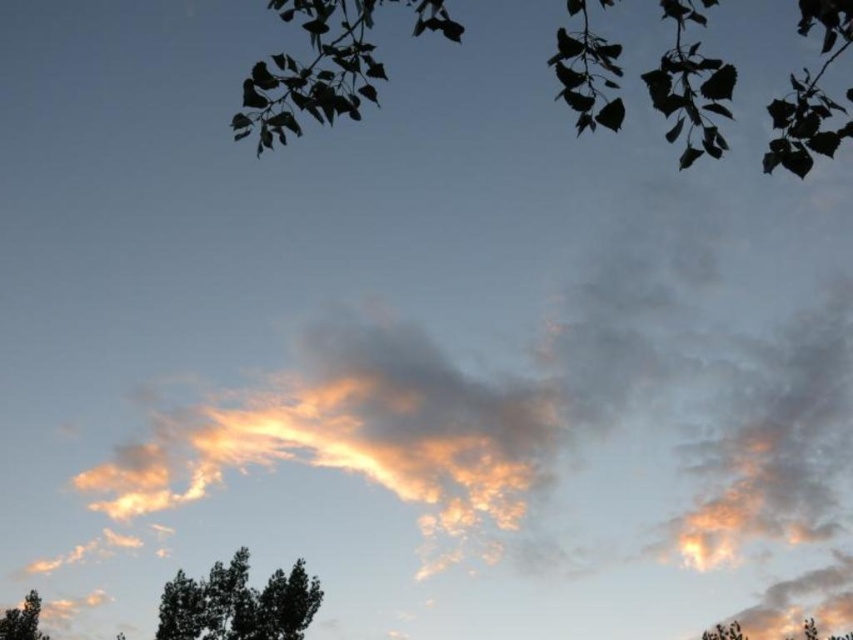
You are an ornithologist observing birds in the sky. You notice the silvery leaves at upper center and the green leafy tree at bottom right. Which object is located to the left of the other?

The silvery leaves at upper center is positioned on the left side of green leafy tree at bottom right.

From the picture: You are standing in the scene and want to move towards the black matte tree at lower left. Which direction should you walk to reach it?

Since the black matte tree at lower left is located at point 0.944 on the x axis and 0.280 on the y axis, you should walk towards the lower left direction to reach it.

You are an artist trying to paint the scene. You notice the silvery leaves at upper center and the green leafy tree at bottom right. Which object should you paint first if you want to follow the rule of painting smaller objects before larger ones?

You should paint the silvery leaves at upper center first because its width is smaller than the green leafy tree at bottom right.